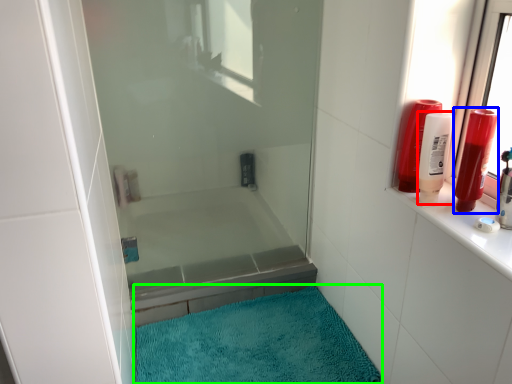
Question: Which object is positioned farthest from toiletry (highlighted by a red box)? Select from toiletry (highlighted by a blue box) and bath mat (highlighted by a green box).

Choices:
 (A) toiletry
 (B) bath mat

Answer: (B)